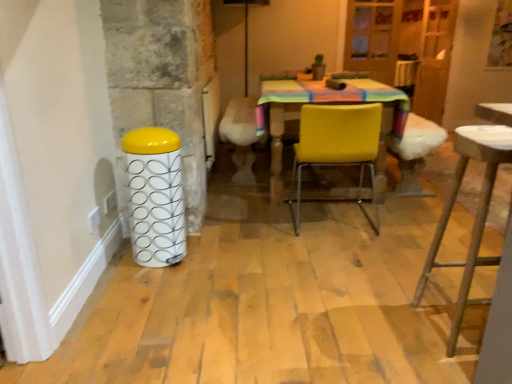
Where is `free space that is in between metallic stool at right and yellow matte chair at center`? The height and width of the screenshot is (384, 512). free space that is in between metallic stool at right and yellow matte chair at center is located at coordinates (374, 266).